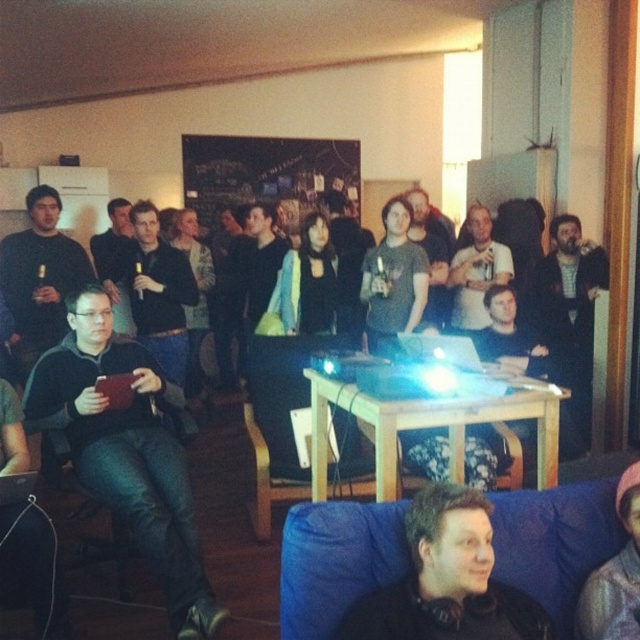
Which is above, pink fuzzy hat at lower right or black leather chair at lower left?

pink fuzzy hat at lower right is above.

Between pink fuzzy hat at lower right and black leather chair at lower left, which one is positioned lower?

black leather chair at lower left is below.

Which is in front, point (589, 586) or point (120, 522)?

Point (589, 586)

At what (x,y) coordinates should I click in order to perform the action: click on pink fuzzy hat at lower right. Please return your answer as a coordinate pair (x, y). The image size is (640, 640). Looking at the image, I should click on (616, 576).

Is matte black jacket at left further to the viewer compared to pink fuzzy hat at lower right?

Yes, it is behind pink fuzzy hat at lower right.

Describe the element at coordinates (125, 451) in the screenshot. I see `matte black jacket at left` at that location.

You are a GUI agent. You are given a task and a screenshot of the screen. Output one action in this format:
    pyautogui.click(x=<x>, y=<y>)
    Task: Click on the matte black jacket at left
    The height and width of the screenshot is (640, 640).
    Given the screenshot: What is the action you would take?
    pyautogui.click(x=125, y=451)

In the scene shown: Who is higher up, blue fabric couch at lower right or black leather chair at lower left?

Positioned higher is blue fabric couch at lower right.

What do you see at coordinates (337, 561) in the screenshot? This screenshot has height=640, width=640. I see `blue fabric couch at lower right` at bounding box center [337, 561].

Image resolution: width=640 pixels, height=640 pixels. I want to click on blue fabric couch at lower right, so pyautogui.click(x=337, y=561).